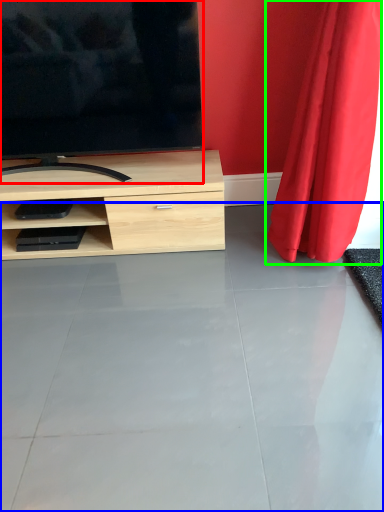
Question: Which is nearer to the television (highlighted by a red box)? concrete (highlighted by a blue box) or curtain (highlighted by a green box).

Choices:
 (A) concrete
 (B) curtain

Answer: (B)